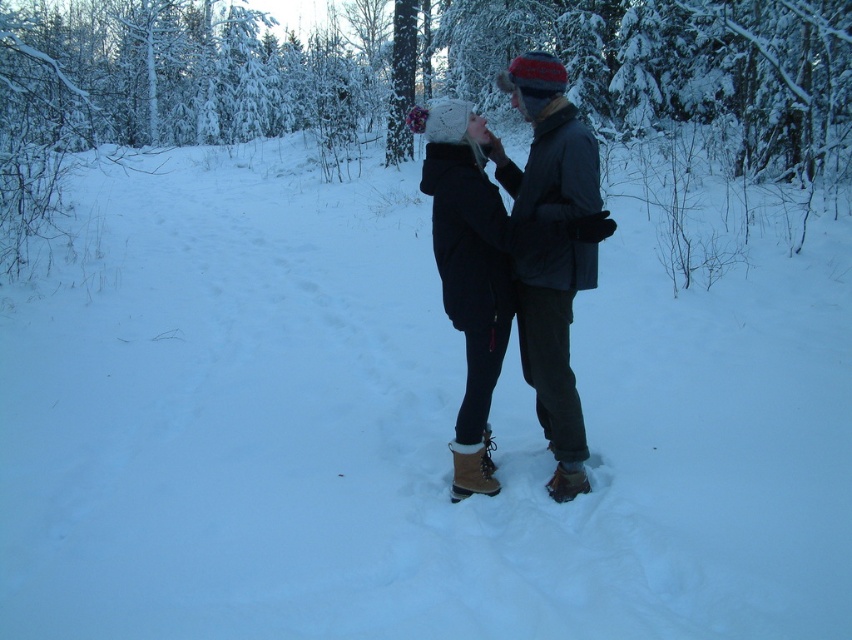
Which is more to the left, brown suede snowshoe at center or brown suede snowshoe at lower center?

Positioned to the left is brown suede snowshoe at center.

Can you confirm if brown suede snowshoe at center is wider than brown suede snowshoe at lower center?

Correct, the width of brown suede snowshoe at center exceeds that of brown suede snowshoe at lower center.

In order to click on brown suede snowshoe at center in this screenshot , I will do `click(473, 468)`.

Does point (452, 481) come in front of point (491, 477)?

Yes, it is.

Which is behind, point (467, 115) or point (487, 492)?

The point (487, 492) is more distant.

Identify the location of knitted woolen hat at center. (468, 273).

Does knitted woolen hat at center have a lesser height compared to brown suede snowshoe at lower center?

No, knitted woolen hat at center is not shorter than brown suede snowshoe at lower center.

Does knitted woolen hat at center appear on the left side of brown suede snowshoe at lower center?

Correct, you'll find knitted woolen hat at center to the left of brown suede snowshoe at lower center.

Measure the distance between point (479,230) and camera.

3.55 meters

Identify the location of knitted woolen hat at center. This screenshot has height=640, width=852. (468, 273).